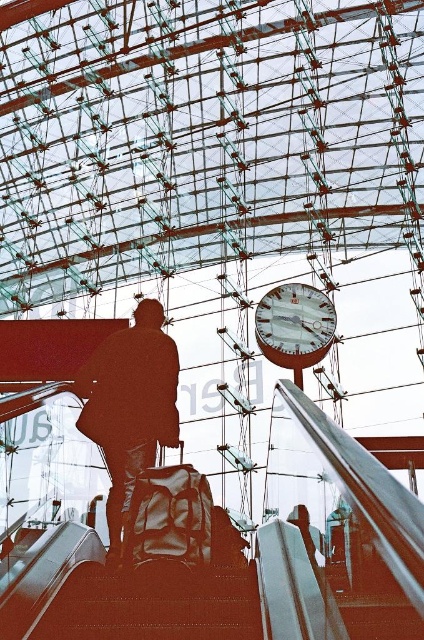
Question: Which point is farther to the camera?

Choices:
 (A) shiny metallic stairs at lower center
 (B) metallic silver clock at upper center

Answer: (B)

Question: Which of these objects is positioned closest to the metallic silver clock at upper center?

Choices:
 (A) silhouette fabric bag at center
 (B) shiny metallic stairs at lower center

Answer: (A)

Question: Is shiny metallic stairs at lower center positioned in front of silhouette fabric bag at center?

Choices:
 (A) yes
 (B) no

Answer: (A)

Question: Can you confirm if shiny metallic stairs at lower center is positioned below metallic silver clock at upper center?

Choices:
 (A) yes
 (B) no

Answer: (A)

Question: Is shiny metallic stairs at lower center further to camera compared to silhouette fabric bag at center?

Choices:
 (A) no
 (B) yes

Answer: (A)

Question: Which point is closer to the camera taking this photo?

Choices:
 (A) (175, 408)
 (B) (290, 284)

Answer: (A)